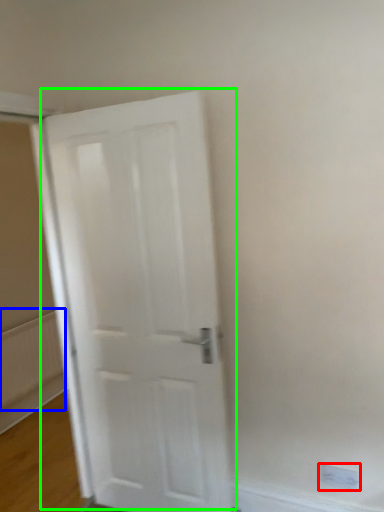
Question: Which is farther away from electric outlet (highlighted by a red box)? radiator (highlighted by a blue box) or door (highlighted by a green box)?

Choices:
 (A) radiator
 (B) door

Answer: (A)